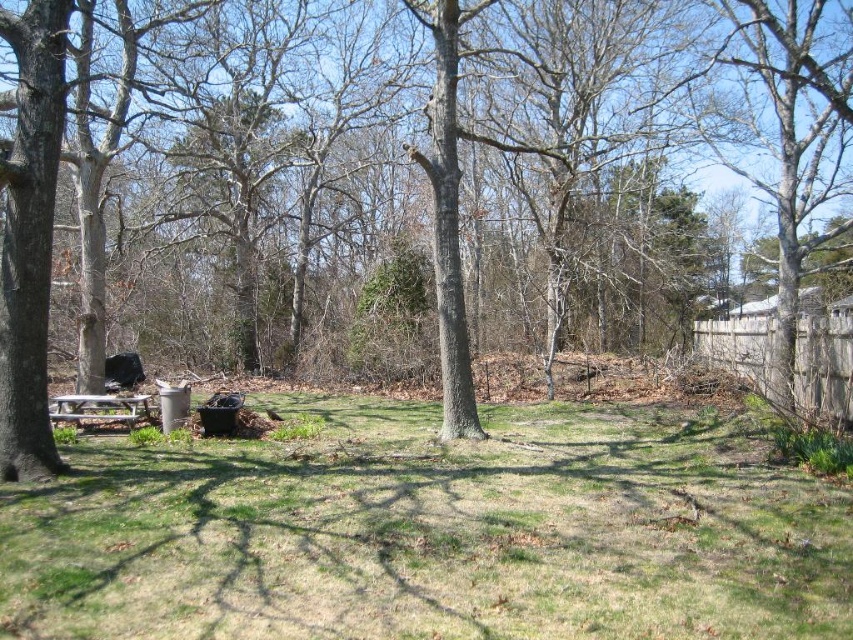
Question: Among these objects, which one is nearest to the camera?

Choices:
 (A) bare wood tree at right
 (B) wooden picnic table at lower left
 (C) wooden fence at right

Answer: (C)

Question: Which of the following is the farthest from the observer?

Choices:
 (A) (831, 332)
 (B) (352, 579)
 (C) (74, 408)
 (D) (840, 227)

Answer: (D)

Question: Can you confirm if bare wood tree at right is bigger than wooden picnic table at lower left?

Choices:
 (A) yes
 (B) no

Answer: (A)

Question: Which of the following is the farthest from the observer?

Choices:
 (A) bare wood tree at right
 (B) wooden fence at right
 (C) green grassy at center

Answer: (A)

Question: Is green grassy at center positioned behind wooden fence at right?

Choices:
 (A) no
 (B) yes

Answer: (A)

Question: Observing the image, what is the correct spatial positioning of green grassy at center in reference to wooden fence at right?

Choices:
 (A) left
 (B) right

Answer: (A)